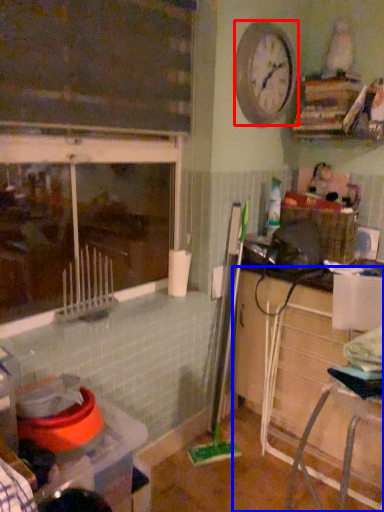
Question: Among these objects, which one is nearest to the camera, clock (highlighted by a red box) or cabinetry (highlighted by a blue box)?

Choices:
 (A) clock
 (B) cabinetry

Answer: (B)